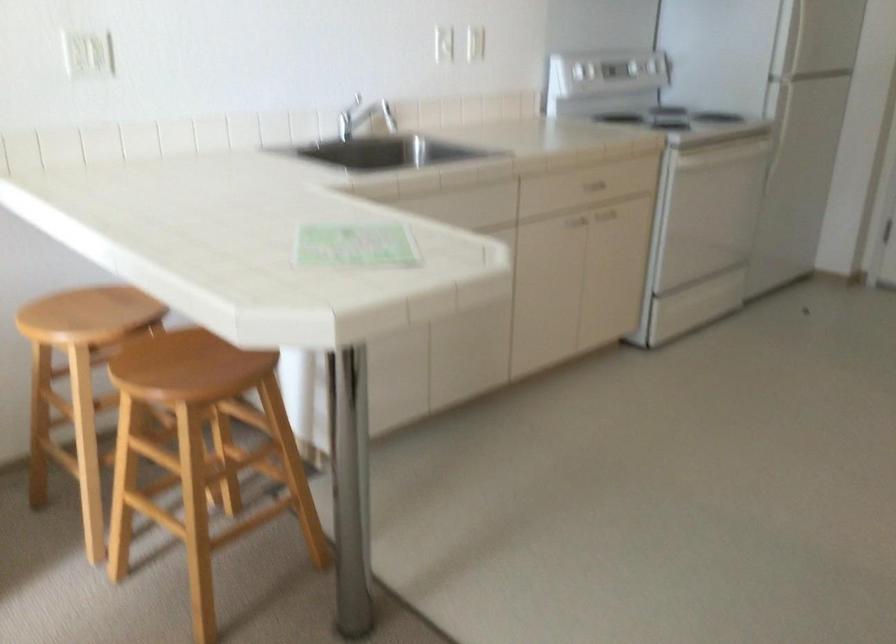
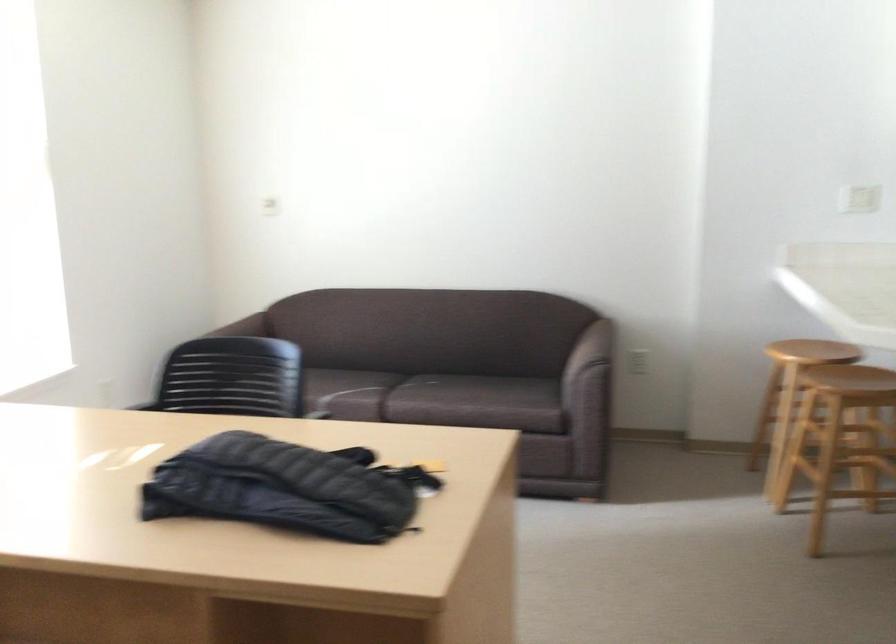
Find the pixel in the second image that matches point 92,82 in the first image.

(858, 198)